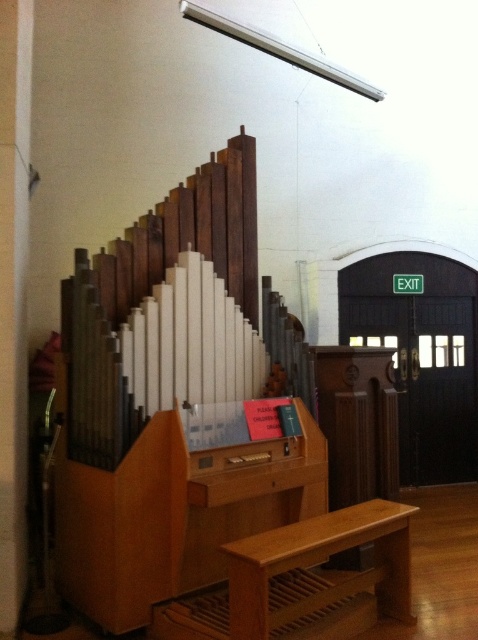
You are standing at the entrance of the church and see the light brown wood church bench at lower center and the wooden stairs at lower center. Which object is nearer to you?

The light brown wood church bench at lower center is closer to the viewer than the wooden stairs at lower center.

You are standing at the entrance of the church and want to sit down. You see the light brown wood church bench at lower center and the wooden stairs at lower center. Which one should you walk towards if you want to sit?

You should walk towards the light brown wood church bench at lower center because it is to the right of the wooden stairs at lower center, meaning it is positioned further to the east side of the church. Since stairs are typically not for sitting, the bench is the appropriate place to sit.